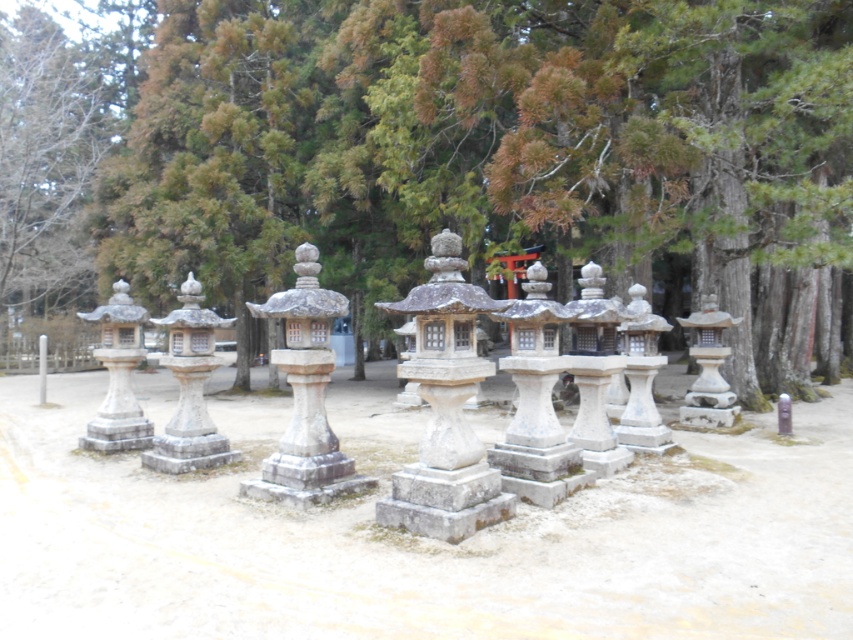
Question: In this image, where is green textured tree at upper center located relative to white stone lantern at center?

Choices:
 (A) below
 (B) above

Answer: (B)

Question: Among these objects, which one is farthest from the camera?

Choices:
 (A) gray stone lantern at center
 (B) white stone lantern at center
 (C) white stone lantern at left
 (D) green textured tree at upper center

Answer: (C)

Question: Can you confirm if green textured tree at upper center is thinner than white stone lantern at left?

Choices:
 (A) yes
 (B) no

Answer: (B)

Question: In this image, where is white stone lantern at center located relative to white stone lantern at left?

Choices:
 (A) right
 (B) left

Answer: (A)

Question: Based on their relative distances, which object is nearer to the gray stone lantern at center?

Choices:
 (A) white stone lantern at center
 (B) white stone lantern at left
 (C) green textured tree at upper center

Answer: (A)

Question: Which of the following is the farthest from the observer?

Choices:
 (A) gray stone lantern at center
 (B) white stone lantern at center
 (C) white stone lantern at left
 (D) green textured tree at upper center

Answer: (C)